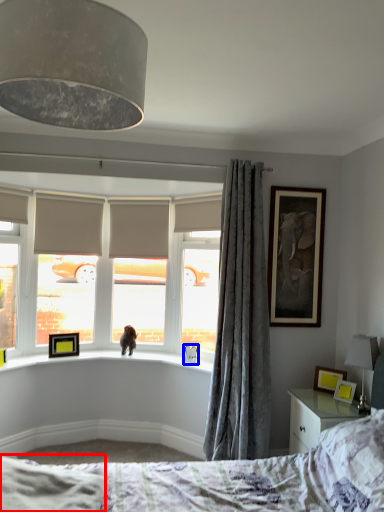
Question: Which object appears closest to the camera in this image, sheet (highlighted by a red box) or animal (highlighted by a blue box)?

Choices:
 (A) sheet
 (B) animal

Answer: (A)